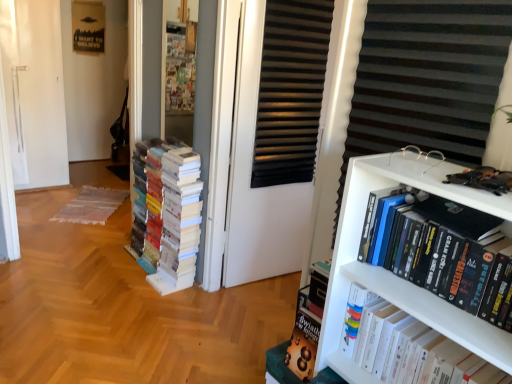
This screenshot has height=384, width=512. Describe the element at coordinates (172, 214) in the screenshot. I see `white paper books at left, which is the first book in left-to-right order` at that location.

Where is `hardcover books at right, which appears as the 3th book when viewed from the back`? This screenshot has width=512, height=384. hardcover books at right, which appears as the 3th book when viewed from the back is located at coordinates (443, 252).

The width and height of the screenshot is (512, 384). What are the coordinates of `black matte screen door at center` in the screenshot? It's located at (275, 136).

What do you see at coordinates (275, 136) in the screenshot? I see `black matte screen door at center` at bounding box center [275, 136].

Where is `white paper books at left, which is the third book from front to back`? white paper books at left, which is the third book from front to back is located at coordinates (172, 214).

Is hardcover book at upper right, positioned as the 2th book in left-to-right order, positioned far away from hardcover books at right, the third book positioned from the left?

That's not correct — hardcover book at upper right, positioned as the 2th book in left-to-right order, is a little close to hardcover books at right, the third book positioned from the left.

Is hardcover book at upper right, the second book from the back, closer to camera compared to hardcover books at right, which is counted as the first book, starting from the front?

No, hardcover book at upper right, the second book from the back, is further to the viewer.

I want to click on book in front of the hardcover book at upper right, positioned as the 2th book in left-to-right order, so click(x=443, y=252).

Between point (384, 291) and point (407, 202), which one is positioned behind?

The point (407, 202) is more distant.

Is hardcover books at right, which appears as the 3th book when viewed from the back, in front of or behind hardcover book at upper right, positioned as the 2th book in left-to-right order, in the image?

hardcover books at right, which appears as the 3th book when viewed from the back, is in front of hardcover book at upper right, positioned as the 2th book in left-to-right order.

Where is `book in front of the hardcover book at upper right, which is the second book in right-to-left order`? This screenshot has width=512, height=384. book in front of the hardcover book at upper right, which is the second book in right-to-left order is located at coordinates (443, 252).

From a real-world perspective, between hardcover books at right, which appears as the 3th book when viewed from the back, and hardcover book at upper right, which is the second book in right-to-left order, who is vertically higher?

hardcover books at right, which appears as the 3th book when viewed from the back, is physically above.

From a real-world perspective, is hardcover book at upper right, positioned as the 2th book in left-to-right order, physically below black matte screen door at center?

Yes, from a real-world perspective, hardcover book at upper right, positioned as the 2th book in left-to-right order, is under black matte screen door at center.

The image size is (512, 384). In order to click on screen door behind the hardcover book at upper right, the second book from the back in this screenshot , I will do `click(275, 136)`.

Is point (425, 296) in front of point (320, 42)?

Yes.

Which of these two, hardcover book at upper right, which is the second book in right-to-left order, or black matte screen door at center, is wider?

hardcover book at upper right, which is the second book in right-to-left order, is wider.

Is black matte screen door at center turned away from white paper books at left, placed as the third book when sorted from right to left?

No, black matte screen door at center is not facing the opposite direction of white paper books at left, placed as the third book when sorted from right to left.

Considering the sizes of objects black matte screen door at center and white paper books at left, acting as the 1th book starting from the back, in the image provided, who is smaller, black matte screen door at center or white paper books at left, acting as the 1th book starting from the back,?

black matte screen door at center.

Do you think black matte screen door at center is within white paper books at left, which is the first book in left-to-right order, or outside of it?

black matte screen door at center is outside white paper books at left, which is the first book in left-to-right order.

Image resolution: width=512 pixels, height=384 pixels. Identify the location of screen door located above the white paper books at left, placed as the third book when sorted from right to left (from a real-world perspective). (275, 136).

From the image's perspective, between hardcover books at right, the third book positioned from the left, and white plastic bookcase at right, which one is located above?

white plastic bookcase at right appears higher in the image.

Between hardcover books at right, which is counted as the first book, starting from the front, and white plastic bookcase at right, which one is positioned in front?

hardcover books at right, which is counted as the first book, starting from the front, is more forward.

Is hardcover books at right, which is counted as the first book, starting from the front, wider or thinner than white plastic bookcase at right?

Clearly, hardcover books at right, which is counted as the first book, starting from the front, has more width compared to white plastic bookcase at right.

Can we say hardcover books at right, which appears as the 3th book when viewed from the back, lies outside white plastic bookcase at right?

Yes.

Is hardcover books at right, the third book positioned from the left, looking in the opposite direction of white paper books at left, placed as the third book when sorted from right to left?

No, white paper books at left, placed as the third book when sorted from right to left, is not at the back of hardcover books at right, the third book positioned from the left.

Between hardcover books at right, positioned as the first book in right-to-left order, and white paper books at left, which is the third book from front to back, which one appears on the right side from the viewer's perspective?

hardcover books at right, positioned as the first book in right-to-left order.

Considering the positions of point (441, 266) and point (177, 241), is point (441, 266) closer or farther from the camera than point (177, 241)?

Point (441, 266) is positioned closer to the camera compared to point (177, 241).

Can you tell me how much hardcover books at right, the third book positioned from the left, and white paper books at left, placed as the third book when sorted from right to left, differ in facing direction?

hardcover books at right, the third book positioned from the left, and white paper books at left, placed as the third book when sorted from right to left, are facing 1.53 degrees away from each other.

I want to click on screen door lying above the white plastic bookcase at right (from the image's perspective), so pos(275,136).

Between white plastic bookcase at right and black matte screen door at center, which one has smaller size?

With smaller size is white plastic bookcase at right.

Is white plastic bookcase at right surrounding black matte screen door at center?

No, white plastic bookcase at right does not contain black matte screen door at center.

Which object is thinner, white plastic bookcase at right or black matte screen door at center?

white plastic bookcase at right.

In order to click on book below the hardcover books at right, the third book positioned from the left (from the image's perspective) in this screenshot , I will do `click(449, 321)`.

This screenshot has width=512, height=384. Identify the location of book on the right of hardcover book at upper right, the second book from the back. (443, 252).

Estimate the real-world distances between objects in this image. Which object is closer to hardcover book at upper right, positioned as the 2th book in left-to-right order, hardcover books at right, which is counted as the first book, starting from the front, or black matte screen door at center?

hardcover books at right, which is counted as the first book, starting from the front, is closer to hardcover book at upper right, positioned as the 2th book in left-to-right order.

Estimate the real-world distances between objects in this image. Which object is closer to white paper books at left, acting as the 1th book starting from the back, white plastic bookcase at right or hardcover books at right, which is counted as the first book, starting from the front?

Based on the image, white plastic bookcase at right appears to be nearer to white paper books at left, acting as the 1th book starting from the back.

Estimate the real-world distances between objects in this image. Which object is closer to hardcover books at right, the third book positioned from the left, white paper books at left, acting as the 1th book starting from the back, or black matte screen door at center?

Based on the image, black matte screen door at center appears to be nearer to hardcover books at right, the third book positioned from the left.

Estimate the real-world distances between objects in this image. Which object is further from white plastic bookcase at right, white paper books at left, which is the first book in left-to-right order, or hardcover book at upper right, which is the second book in right-to-left order?

Based on the image, white paper books at left, which is the first book in left-to-right order, appears to be further to white plastic bookcase at right.

From the image, which object appears to be nearer to black matte screen door at center, white plastic bookcase at right or hardcover book at upper right, the second book from the back?

The object closer to black matte screen door at center is white plastic bookcase at right.

Considering their positions, is hardcover books at right, positioned as the first book in right-to-left order, positioned closer to white paper books at left, which is the first book in left-to-right order, than black matte screen door at center?

black matte screen door at center is closer to white paper books at left, which is the first book in left-to-right order.

Looking at the image, which one is located closer to white plastic bookcase at right, hardcover book at upper right, which is the second book in right-to-left order, or white paper books at left, which is the third book from front to back?

hardcover book at upper right, which is the second book in right-to-left order, is closer to white plastic bookcase at right.

From the image, which object appears to be farther from black matte screen door at center, white paper books at left, placed as the third book when sorted from right to left, or hardcover book at upper right, which is the second book in right-to-left order?

hardcover book at upper right, which is the second book in right-to-left order.

The width and height of the screenshot is (512, 384). I want to click on bookcase positioned between hardcover book at upper right, which is the second book in right-to-left order, and black matte screen door at center from near to far, so click(419, 275).

Where is `book between white plastic bookcase at right and hardcover book at upper right, which is the second book in right-to-left order, in the up-down direction`? This screenshot has width=512, height=384. book between white plastic bookcase at right and hardcover book at upper right, which is the second book in right-to-left order, in the up-down direction is located at coordinates (443, 252).

Locate an element on the screen. screen door positioned between white plastic bookcase at right and white paper books at left, placed as the third book when sorted from right to left, from near to far is located at coordinates (275, 136).

What are the coordinates of `book located between hardcover books at right, the third book positioned from the left, and black matte screen door at center in the depth direction` in the screenshot? It's located at (449, 321).